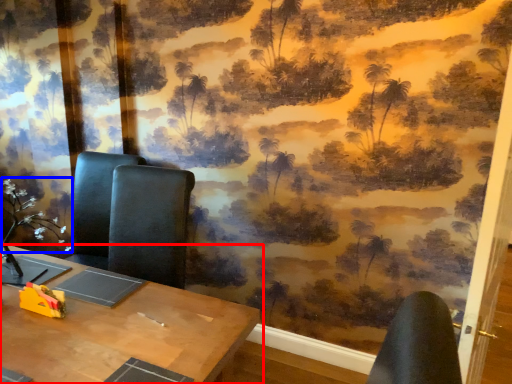
Question: Which object appears farthest to the camera in this image, table (highlighted by a red box) or flower (highlighted by a blue box)?

Choices:
 (A) table
 (B) flower

Answer: (B)